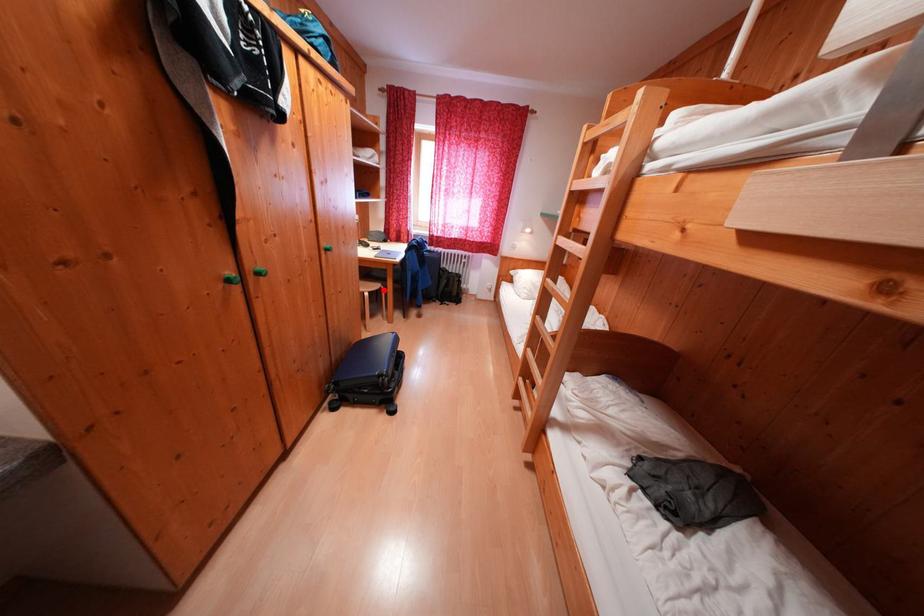
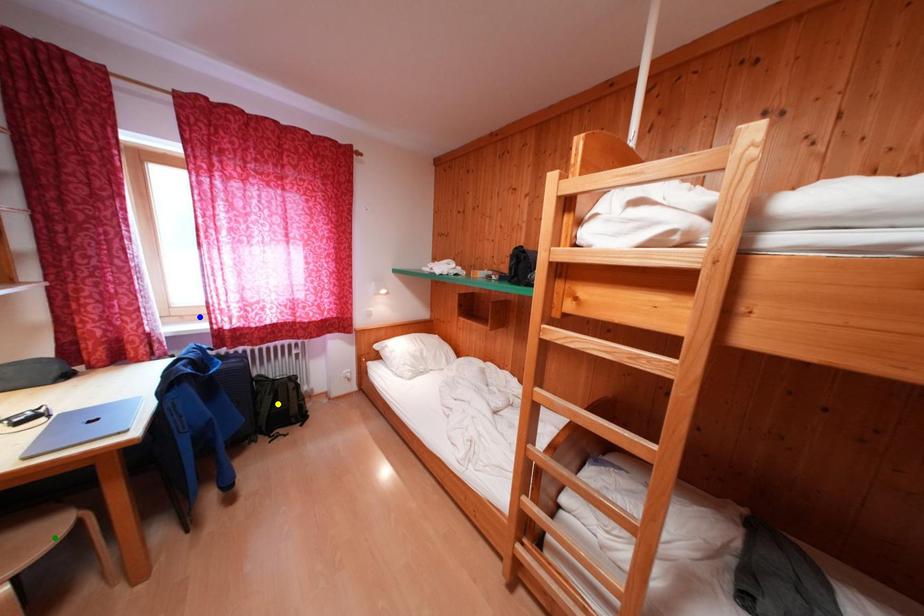
Question: I am providing you with two images of the same scene from different viewpoints. A red point is marked on the first image. You are given multiple points on the second image. In image 2, which mark is for the same physical point as the one in image 1?

Choices:
 (A) yellow point
 (B) blue point
 (C) green point

Answer: (C)